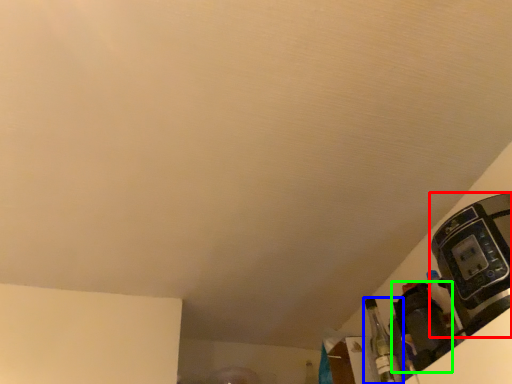
Question: Based on their relative distances, which object is nearer to coffee machine (highlighted by a red box)? Choose from bottle (highlighted by a blue box) and appliance (highlighted by a green box).

Choices:
 (A) bottle
 (B) appliance

Answer: (B)